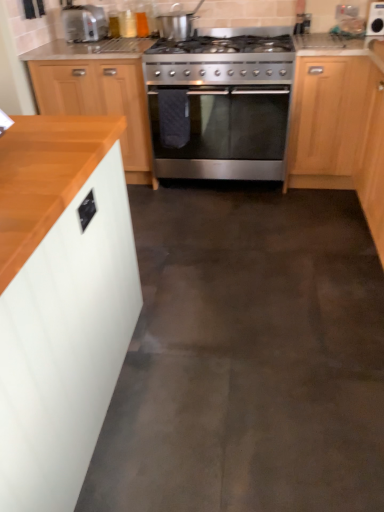
Question: From a real-world perspective, is stainless steel gas stove at center beneath matte silver toaster at upper left?

Choices:
 (A) no
 (B) yes

Answer: (B)

Question: Is stainless steel gas stove at center further to camera compared to matte silver toaster at upper left?

Choices:
 (A) no
 (B) yes

Answer: (A)

Question: Is stainless steel gas stove at center facing towards matte silver toaster at upper left?

Choices:
 (A) yes
 (B) no

Answer: (B)

Question: From the image's perspective, is stainless steel gas stove at center on matte silver toaster at upper left?

Choices:
 (A) no
 (B) yes

Answer: (A)

Question: Is stainless steel gas stove at center not close to matte silver toaster at upper left?

Choices:
 (A) yes
 (B) no

Answer: (B)

Question: Considering the positions of point [49, 108] and point [72, 20], is point [49, 108] closer or farther from the camera than point [72, 20]?

Choices:
 (A) farther
 (B) closer

Answer: (B)

Question: In terms of height, does wooden cabinet at left, the third cabinetry when ordered from front to back, look taller or shorter compared to matte silver toaster at upper left?

Choices:
 (A) short
 (B) tall

Answer: (B)

Question: From a real-world perspective, is wooden cabinet at left, the third cabinetry when ordered from front to back, physically located above or below matte silver toaster at upper left?

Choices:
 (A) below
 (B) above

Answer: (A)

Question: Is wooden cabinet at left, acting as the first cabinetry starting from the back, inside or outside of matte silver toaster at upper left?

Choices:
 (A) outside
 (B) inside

Answer: (A)

Question: Is stainless steel gas stove at center spatially inside stainless steel oven at center, or outside of it?

Choices:
 (A) outside
 (B) inside

Answer: (A)

Question: From a real-world perspective, is stainless steel gas stove at center physically located above or below stainless steel oven at center?

Choices:
 (A) above
 (B) below

Answer: (A)

Question: In the image, is stainless steel gas stove at center on the left side or the right side of stainless steel oven at center?

Choices:
 (A) right
 (B) left

Answer: (B)

Question: From the image's perspective, relative to stainless steel oven at center, is stainless steel gas stove at center above or below?

Choices:
 (A) below
 (B) above

Answer: (B)

Question: Is wooden cabinet at left, acting as the first cabinetry starting from the back, to the left or to the right of stainless steel gas stove at center in the image?

Choices:
 (A) right
 (B) left

Answer: (B)

Question: From a real-world perspective, relative to stainless steel gas stove at center, is wooden cabinet at left, acting as the first cabinetry starting from the back, vertically above or below?

Choices:
 (A) above
 (B) below

Answer: (B)